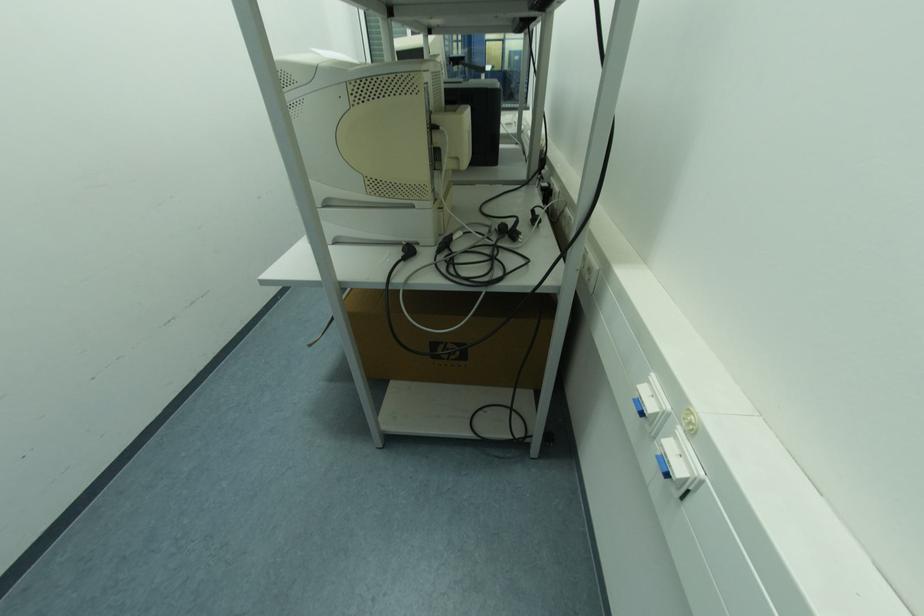
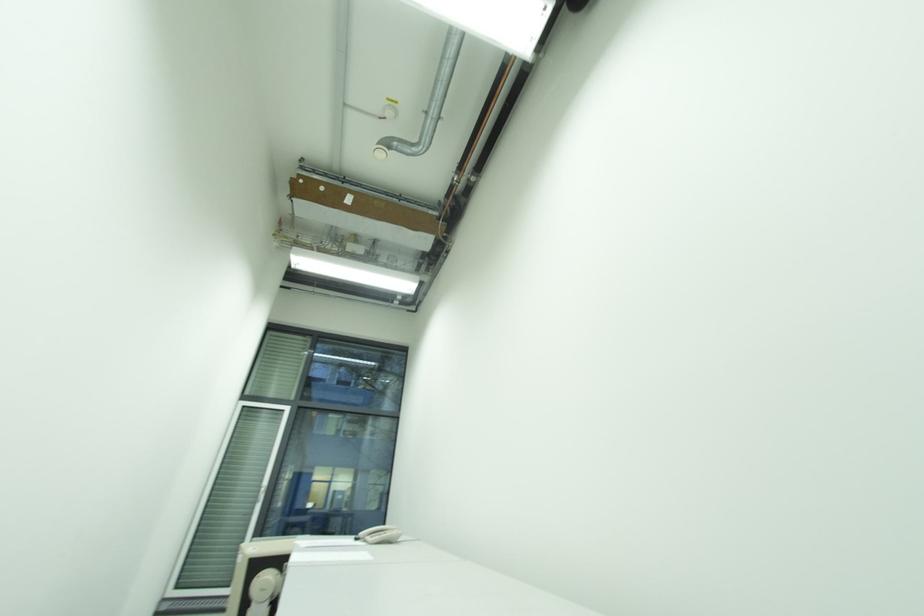
Based on the continuous images, in which direction is the camera rotating?

The camera rotated toward right-up.